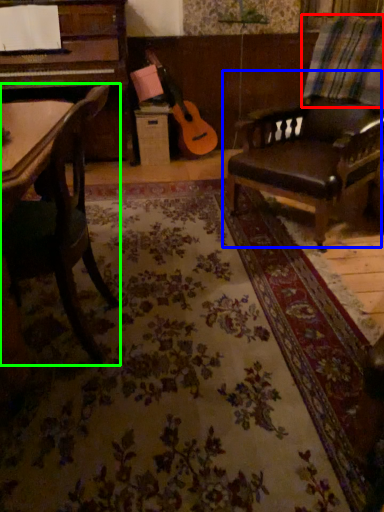
Question: Based on their relative distances, which object is farther from plaid (highlighted by a red box)? Choose from chair (highlighted by a blue box) and chair (highlighted by a green box).

Choices:
 (A) chair
 (B) chair

Answer: (B)